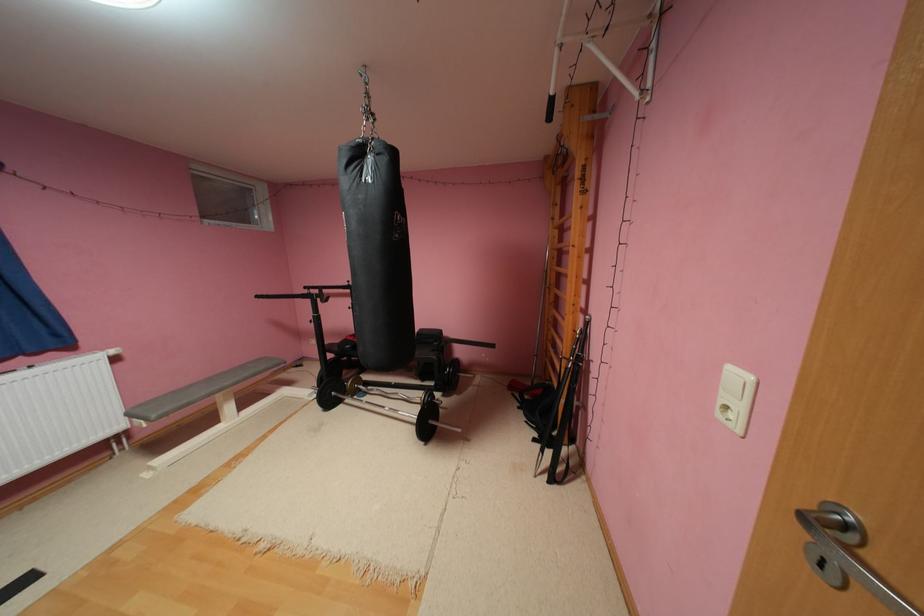
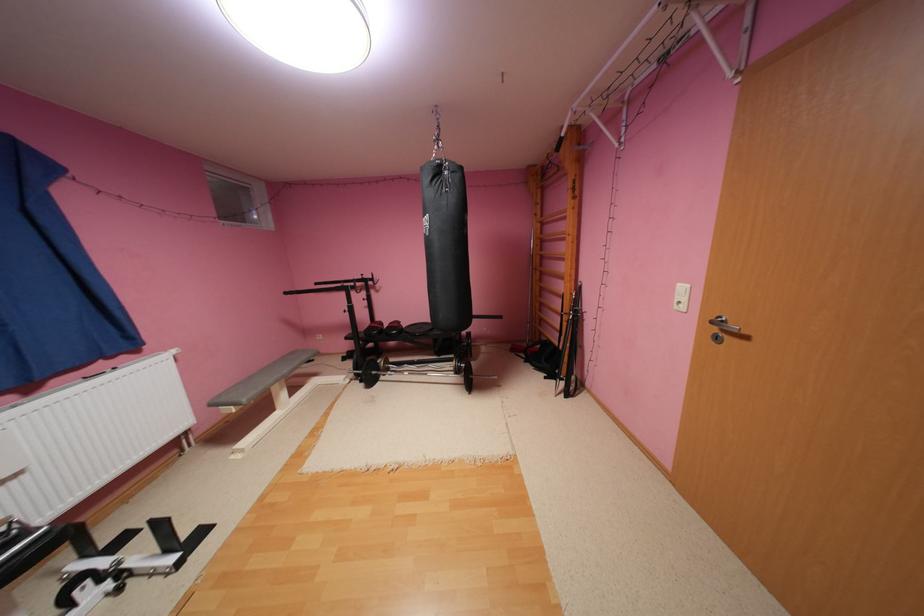
In the second image, find the point that corresponds to point 584,331 in the first image.

(580, 294)